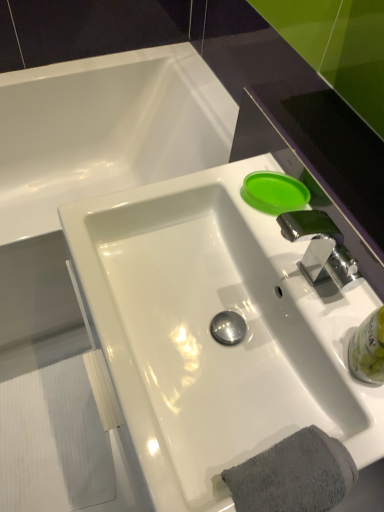
You are a GUI agent. You are given a task and a screenshot of the screen. Output one action in this format:
    pyautogui.click(x=<x>, y=<y>)
    Task: Click on the free space in front of green matte lid at upper right, the 2th liquid positioned from the front
    This screenshot has width=384, height=512.
    Given the screenshot: What is the action you would take?
    pyautogui.click(x=292, y=254)